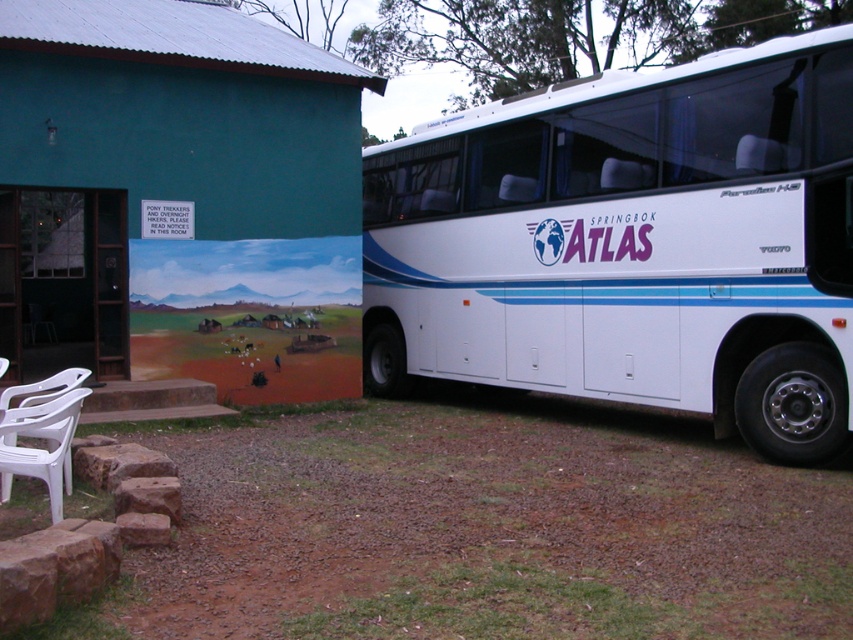
You are standing in front of the small building with a corrugated metal roof and the white bus parked next to it. There is a point marked at coordinates (631, 243). What object is located at this point?

The point at coordinates (631, 243) marks the white glossy decorative bus at right.